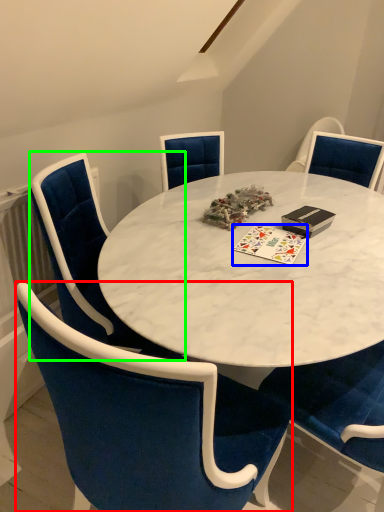
Question: Considering the real-world distances, which object is closest to chair (highlighted by a red box)? card game (highlighted by a blue box) or chair (highlighted by a green box).

Choices:
 (A) card game
 (B) chair

Answer: (B)